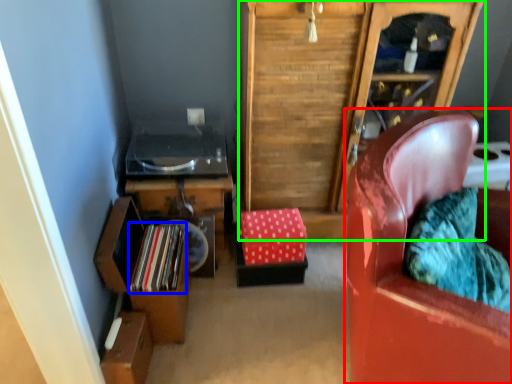
Question: Estimate the real-world distances between objects in this image. Which object is closer to chair (highlighted by a red box), book (highlighted by a blue box) or cabinetry (highlighted by a green box)?

Choices:
 (A) book
 (B) cabinetry

Answer: (B)